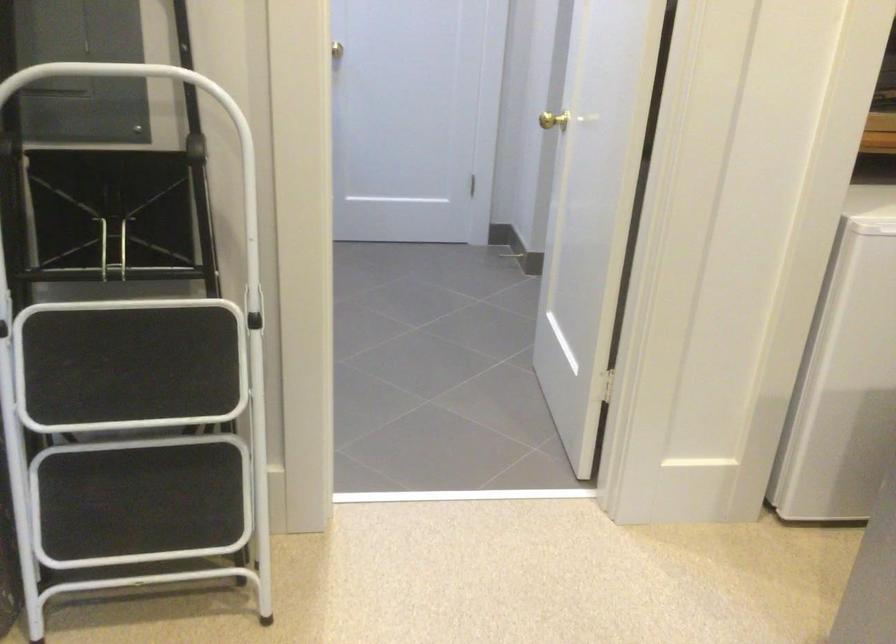
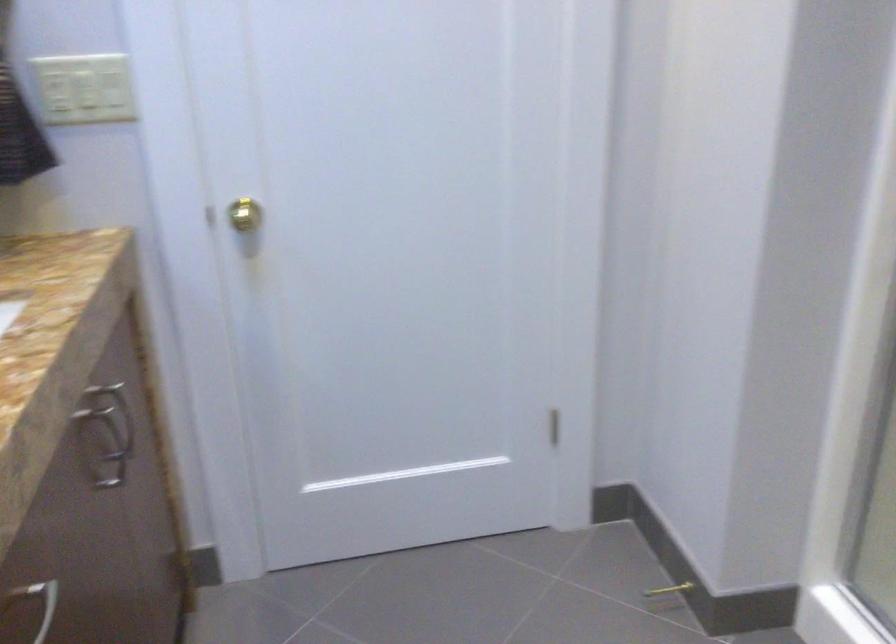
The point at (529, 265) is marked in the first image. Where is the corresponding point in the second image?

(666, 596)